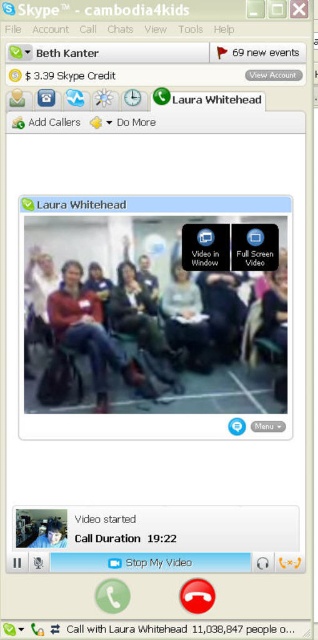
Question: Which point is closer to the camera?

Choices:
 (A) (200, 308)
 (B) (198, 308)
 (C) (81, 344)

Answer: (C)

Question: Which point is farther from the camera taking this photo?

Choices:
 (A) (211, 353)
 (B) (82, 236)
 (C) (71, 320)
 (D) (64, 525)

Answer: (A)

Question: Observing the image, what is the correct spatial positioning of matte red sweater at center in reference to blue fabric face mask at center?

Choices:
 (A) below
 (B) above

Answer: (B)

Question: Is matte black laptop at center thinner than blue fabric face mask at center?

Choices:
 (A) no
 (B) yes

Answer: (A)

Question: Can you confirm if matte black laptop at center is positioned above blue fabric face mask at center?

Choices:
 (A) yes
 (B) no

Answer: (A)

Question: Which object is the closest to the matte black laptop at center?

Choices:
 (A) matte black jacket at center
 (B) blue fabric face mask at center

Answer: (A)